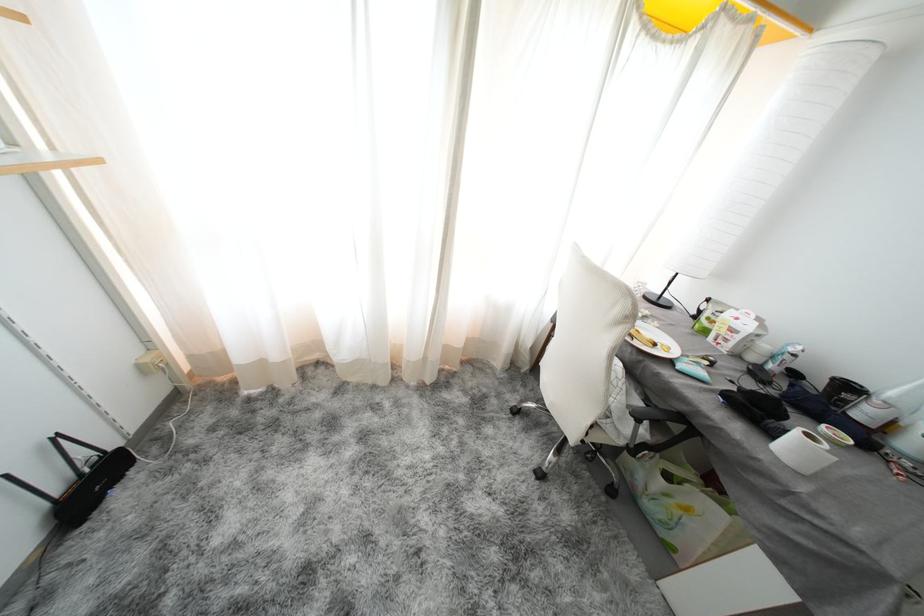
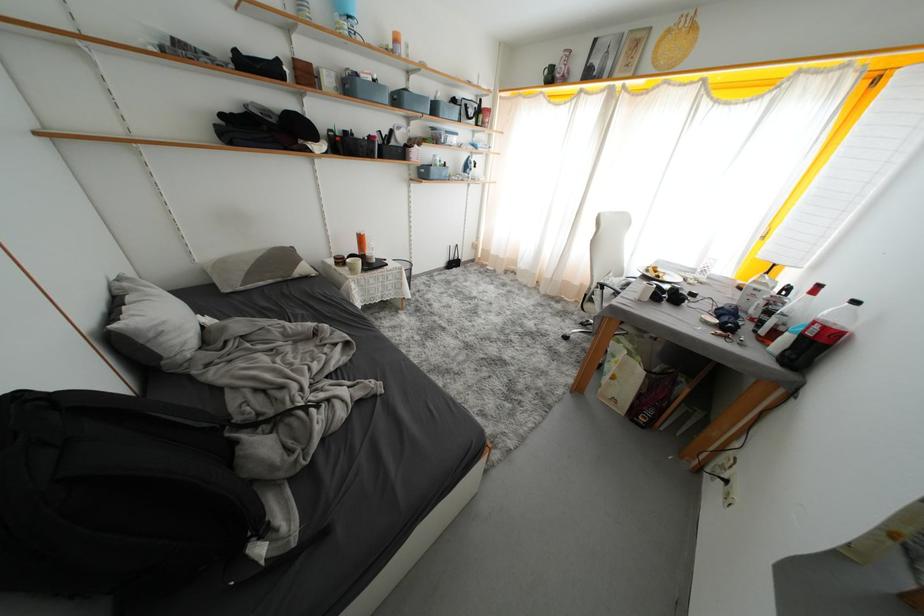
In the second image, find the point that corresponds to point 661,349 in the first image.

(664, 281)